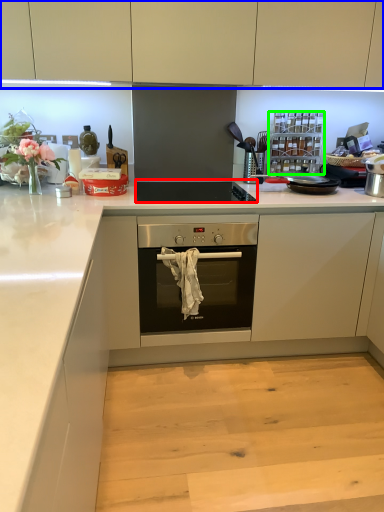
Question: Based on their relative distances, which object is nearer to gas stove (highlighted by a red box)? Choose from cabinetry (highlighted by a blue box) and appliance (highlighted by a green box).

Choices:
 (A) cabinetry
 (B) appliance

Answer: (B)